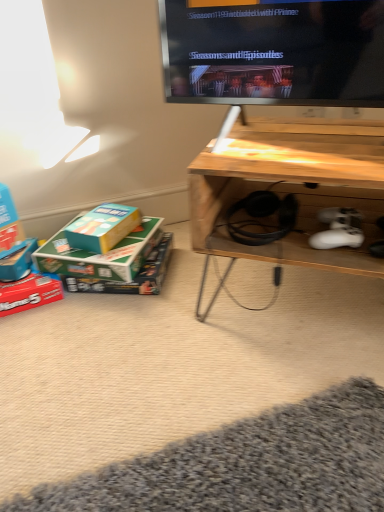
Find the location of a particular element. The image size is (384, 512). matte blue box at lower left, the first box viewed from the left is located at coordinates (17, 260).

This screenshot has height=512, width=384. Describe the element at coordinates (17, 260) in the screenshot. I see `matte blue box at lower left, the first box viewed from the left` at that location.

At what (x,y) coordinates should I click in order to perform the action: click on green cardboard box at lower left, the third box positioned from the left. Please return your answer as a coordinate pair (x, y). The width and height of the screenshot is (384, 512). Looking at the image, I should click on (100, 255).

Image resolution: width=384 pixels, height=512 pixels. Describe the element at coordinates (289, 190) in the screenshot. I see `wooden desk at lower right` at that location.

The height and width of the screenshot is (512, 384). Identify the location of matte blue box at lower left, arranged as the fourth box when viewed from the right. (17, 260).

Which is closer to the camera, (154, 222) or (302, 198)?

Clearly, point (154, 222) is more distant from the camera than point (302, 198).

Choose the correct answer: Is green cardboard box at lower left, the second box from the right, inside wooden desk at lower right or outside it?

green cardboard box at lower left, the second box from the right, cannot be found inside wooden desk at lower right.

Is green cardboard box at lower left, the second box from the right, directly adjacent to wooden desk at lower right?

No, green cardboard box at lower left, the second box from the right, is not making contact with wooden desk at lower right.

Are matte red box at lower left, the third box from the right, and wooden desk at lower right beside each other?

No, matte red box at lower left, the third box from the right, is not touching wooden desk at lower right.

Which is more to the right, matte red box at lower left, the third box from the right, or wooden desk at lower right?

From the viewer's perspective, wooden desk at lower right appears more on the right side.

Based on the photo, does matte red box at lower left, the third box from the right, turn towards wooden desk at lower right?

No, matte red box at lower left, the third box from the right, is not oriented towards wooden desk at lower right.

From the image's perspective, who appears lower, green cardboard box at lower left, the third box positioned from the left, or matte red box at lower left, the third box from the right?

matte red box at lower left, the third box from the right, appears lower in the image.

Is green cardboard box at lower left, the third box positioned from the left, aimed at matte red box at lower left, the third box from the right?

No, green cardboard box at lower left, the third box positioned from the left, is not facing towards matte red box at lower left, the third box from the right.

Does green cardboard box at lower left, the third box positioned from the left, have a larger size compared to matte red box at lower left, the third box from the right?

Correct, green cardboard box at lower left, the third box positioned from the left, is larger in size than matte red box at lower left, the third box from the right.

Can you confirm if green cardboard box at lower left, the third box positioned from the left, is wider than matte red box at lower left, the 2th box in the left-to-right sequence?

Indeed, green cardboard box at lower left, the third box positioned from the left, has a greater width compared to matte red box at lower left, the 2th box in the left-to-right sequence.

Looking at this image, who is smaller, teal cardboard box at lower left, the fourth box in the left-to-right sequence, or matte red box at lower left, the third box from the right?

Smaller between the two is teal cardboard box at lower left, the fourth box in the left-to-right sequence.

Is teal cardboard box at lower left, arranged as the first box when viewed from the right, inside or outside of matte red box at lower left, the third box from the right?

The correct answer is: outside.

Does point (111, 227) lie in front of point (27, 287)?

That is False.

How many degrees apart are the facing directions of teal cardboard box at lower left, the fourth box in the left-to-right sequence, and matte red box at lower left, the 2th box in the left-to-right sequence?

They differ by 50.4 degrees in their facing directions.

Is matte red box at lower left, the 2th box in the left-to-right sequence, in contact with green cardboard box at lower left, the second box from the right?

They are not placed beside each other.

Is matte red box at lower left, the 2th box in the left-to-right sequence, completely or partially outside of green cardboard box at lower left, the third box positioned from the left?

Yes, matte red box at lower left, the 2th box in the left-to-right sequence, is outside of green cardboard box at lower left, the third box positioned from the left.

Considering the relative sizes of matte red box at lower left, the 2th box in the left-to-right sequence, and green cardboard box at lower left, the second box from the right, in the image provided, is matte red box at lower left, the 2th box in the left-to-right sequence, shorter than green cardboard box at lower left, the second box from the right,?

Incorrect, the height of matte red box at lower left, the 2th box in the left-to-right sequence, does not fall short of that of green cardboard box at lower left, the second box from the right.

Is matte red box at lower left, the third box from the right, bigger or smaller than green cardboard box at lower left, the second box from the right?

Clearly, matte red box at lower left, the third box from the right, is smaller in size than green cardboard box at lower left, the second box from the right.

Is matte red box at lower left, the 2th box in the left-to-right sequence, looking in the opposite direction of matte blue box at lower left, the first box viewed from the left?

No.

Is matte blue box at lower left, the first box viewed from the left, located within matte red box at lower left, the third box from the right?

No, matte blue box at lower left, the first box viewed from the left, is not a part of matte red box at lower left, the third box from the right.

Is matte red box at lower left, the third box from the right, smaller than matte blue box at lower left, the first box viewed from the left?

No.

From a real-world perspective, is matte red box at lower left, the 2th box in the left-to-right sequence, on matte blue box at lower left, arranged as the fourth box when viewed from the right?

Incorrect, from a real-world perspective, matte red box at lower left, the 2th box in the left-to-right sequence, is lower than matte blue box at lower left, arranged as the fourth box when viewed from the right.

Can you confirm if wooden desk at lower right is thinner than teal cardboard box at lower left, the fourth box in the left-to-right sequence?

Incorrect, the width of wooden desk at lower right is not less than that of teal cardboard box at lower left, the fourth box in the left-to-right sequence.

How different are the orientations of wooden desk at lower right and teal cardboard box at lower left, the fourth box in the left-to-right sequence, in degrees?

The angle between the facing direction of wooden desk at lower right and the facing direction of teal cardboard box at lower left, the fourth box in the left-to-right sequence, is 6.07 degrees.

From the image's perspective, between wooden desk at lower right and teal cardboard box at lower left, the fourth box in the left-to-right sequence, who is located below?

From the image's view, teal cardboard box at lower left, the fourth box in the left-to-right sequence, is below.

Is wooden desk at lower right outside of teal cardboard box at lower left, the fourth box in the left-to-right sequence?

That's correct, wooden desk at lower right is outside of teal cardboard box at lower left, the fourth box in the left-to-right sequence.

Locate an element on the screen. This screenshot has width=384, height=512. table on the right of green cardboard box at lower left, the third box positioned from the left is located at coordinates (289, 190).

From the wooden desk at lower right, count 1st boxs backward and point to it. Please provide its 2D coordinates.

[(29, 293)]

Which object lies further to the anchor point teal cardboard box at lower left, the fourth box in the left-to-right sequence, wooden desk at lower right or green cardboard box at lower left, the third box positioned from the left?

wooden desk at lower right is further to teal cardboard box at lower left, the fourth box in the left-to-right sequence.

When comparing their distances from matte blue box at lower left, arranged as the fourth box when viewed from the right, does matte red box at lower left, the third box from the right, or teal cardboard box at lower left, the fourth box in the left-to-right sequence, seem further?

teal cardboard box at lower left, the fourth box in the left-to-right sequence, lies further to matte blue box at lower left, arranged as the fourth box when viewed from the right, than the other object.

Based on their spatial positions, is matte red box at lower left, the 2th box in the left-to-right sequence, or wooden desk at lower right further from green cardboard box at lower left, the third box positioned from the left?

wooden desk at lower right lies further to green cardboard box at lower left, the third box positioned from the left, than the other object.

Considering their positions, is teal cardboard box at lower left, the fourth box in the left-to-right sequence, positioned closer to matte red box at lower left, the 2th box in the left-to-right sequence, than wooden desk at lower right?

teal cardboard box at lower left, the fourth box in the left-to-right sequence, is closer to matte red box at lower left, the 2th box in the left-to-right sequence.

Which object lies further to the anchor point matte red box at lower left, the third box from the right, teal cardboard box at lower left, the fourth box in the left-to-right sequence, or matte blue box at lower left, the first box viewed from the left?

teal cardboard box at lower left, the fourth box in the left-to-right sequence, is positioned further to the anchor matte red box at lower left, the third box from the right.

Based on the photo, looking at the image, which one is located closer to green cardboard box at lower left, the third box positioned from the left, matte red box at lower left, the 2th box in the left-to-right sequence, or matte blue box at lower left, the first box viewed from the left?

Based on the image, matte red box at lower left, the 2th box in the left-to-right sequence, appears to be nearer to green cardboard box at lower left, the third box positioned from the left.

When comparing their distances from matte red box at lower left, the 2th box in the left-to-right sequence, does matte blue box at lower left, arranged as the fourth box when viewed from the right, or teal cardboard box at lower left, arranged as the first box when viewed from the right, seem closer?

matte blue box at lower left, arranged as the fourth box when viewed from the right, lies closer to matte red box at lower left, the 2th box in the left-to-right sequence, than the other object.

Considering their positions, is matte blue box at lower left, the first box viewed from the left, positioned further to matte red box at lower left, the 2th box in the left-to-right sequence, than green cardboard box at lower left, the second box from the right?

green cardboard box at lower left, the second box from the right.

Image resolution: width=384 pixels, height=512 pixels. I want to click on box situated between matte red box at lower left, the third box from the right, and teal cardboard box at lower left, arranged as the first box when viewed from the right, from left to right, so click(100, 255).

Image resolution: width=384 pixels, height=512 pixels. I want to click on box between green cardboard box at lower left, the second box from the right, and wooden desk at lower right, in the horizontal direction, so click(102, 227).

This screenshot has height=512, width=384. I want to click on box located between matte blue box at lower left, arranged as the fourth box when viewed from the right, and green cardboard box at lower left, the third box positioned from the left, in the left-right direction, so click(29, 293).